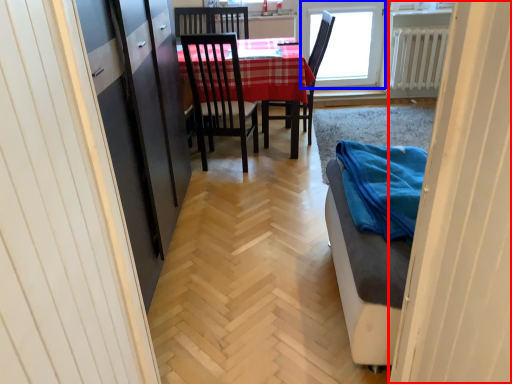
Question: Among these objects, which one is farthest to the camera, door (highlighted by a red box) or window (highlighted by a blue box)?

Choices:
 (A) door
 (B) window

Answer: (B)